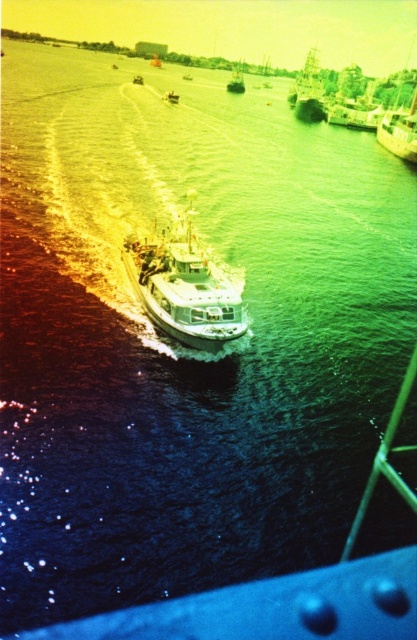
You are a photographer trying to capture the white glossy boat at center in your shot. You are currently positioned at the point marked by the coordinates point (183,291). Can you see the white glossy boat at center from your current position?

The white glossy boat at center is represented by point (183,291), so yes, you are positioned exactly at the location of the boat and can see it clearly from there.

You are a photographer planning to take a photo of the shiny silver boat at upper right and the metallic silver boat at center. Based on their positions, which boat should you focus on first if you want to capture both in a single frame without moving the camera?

The shiny silver boat at upper right is below the metallic silver boat at center, so you should focus on the metallic silver boat at center first as it is higher in the frame.

You are standing on the dock and see the shiny silver boat at upper right. If the boat is moving towards you at a speed of 10 feet per second, how many seconds will it take for the boat to reach you?

The shiny silver boat at upper right and viewer are 441.74 feet apart from each other. At a speed of 10 feet per second, it will take 441.74 divided by 10, which is approximately 44.17 seconds for the boat to reach you.